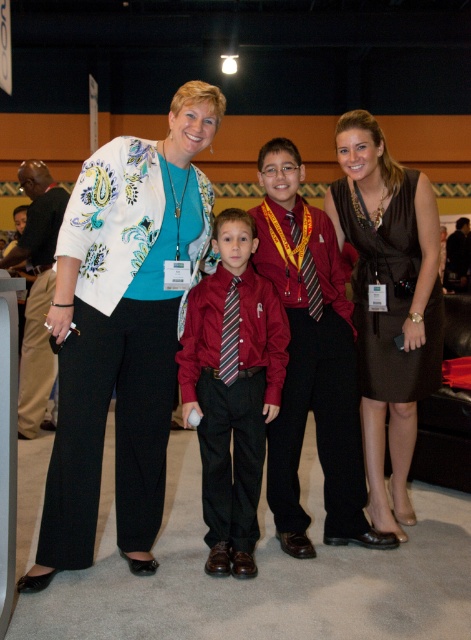
You are a photographer standing at a certain distance from the group. You want to take a closeup shot of the white floral blazer at center. The camera you are using has a minimum focusing distance of 5 feet. Can you take the photo without moving closer?

The distance between the white floral blazer at center and the camera is 6.55 feet, which is greater than the minimum focusing distance of 5 feet. Therefore, you can take the photo without moving closer.

You are a photographer at the event and need to adjust the lighting for the group photo. The matte red shirt at center and the khaki pants at center are both in the frame. Which of these two items is narrower in width?

The matte red shirt at center has a lesser width compared to khaki pants at center, so the matte red shirt at center is narrower in width.